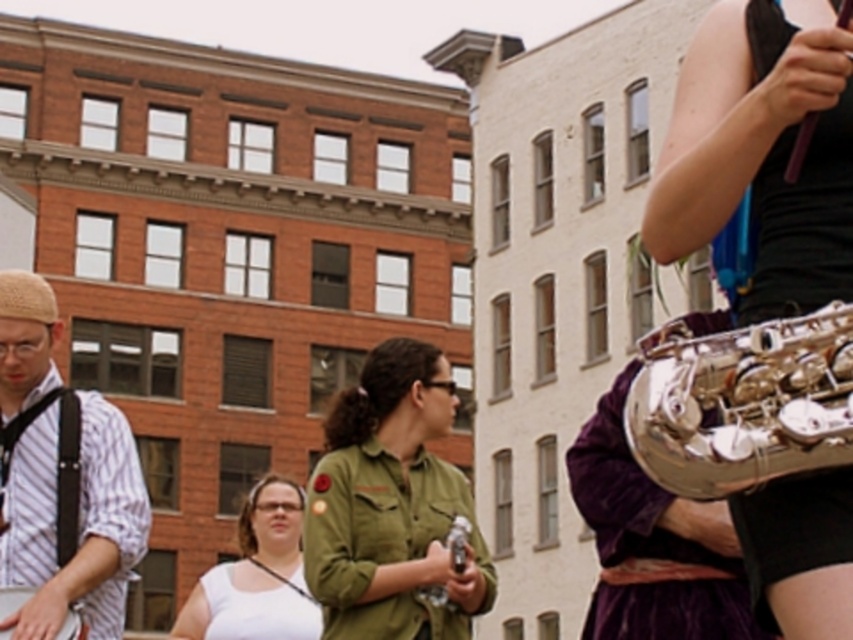
You are a photographer standing in the urban scene and want to take a closeup photo of the shiny silver saxophone at right. Considering your current position, can you estimate whether you need to move closer or farther away to get a better closeup shot?

The shiny silver saxophone at right is 10.30 meters away from the viewer. To take a closeup photo, you would need to move closer to reduce the distance between yourself and the saxophone.

You are a photographer standing in the scene and want to take a photo of the clear plastic bottle at center without the white matte tank top at center blocking it. How should you adjust your position?

Move your position so that the clear plastic bottle at center is no longer behind the white matte tank top at center. Since the white matte tank top at center is closer to you, moving sideways or angling your camera could allow you to capture the bottle without obstruction.

You are a photographer trying to capture a candid shot of the white matte tank top at center and the clear plastic bottle at center. Based on their positions, which one should you focus on first if you want to capture both in the same frame without moving the camera?

The white matte tank top at center is located below the clear plastic bottle at center, so you should focus on the clear plastic bottle at center first since it is higher up and will be in focus if the camera is set to auto focus on the center.